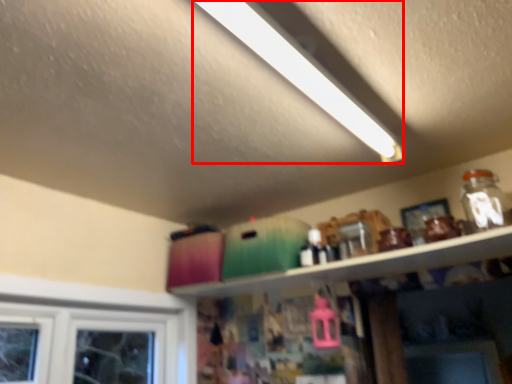
Question: Considering the relative positions of light (annotated by the red box) and shelf in the image provided, where is light (annotated by the red box) located with respect to the staircase?

Choices:
 (A) right
 (B) left

Answer: (B)